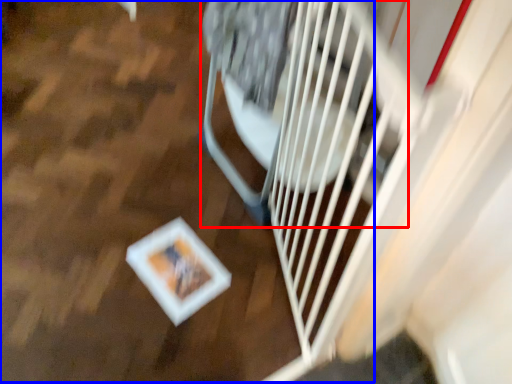
Question: Which object is further to the camera taking this photo, wide (highlighted by a red box) or wood (highlighted by a blue box)?

Choices:
 (A) wide
 (B) wood

Answer: (B)